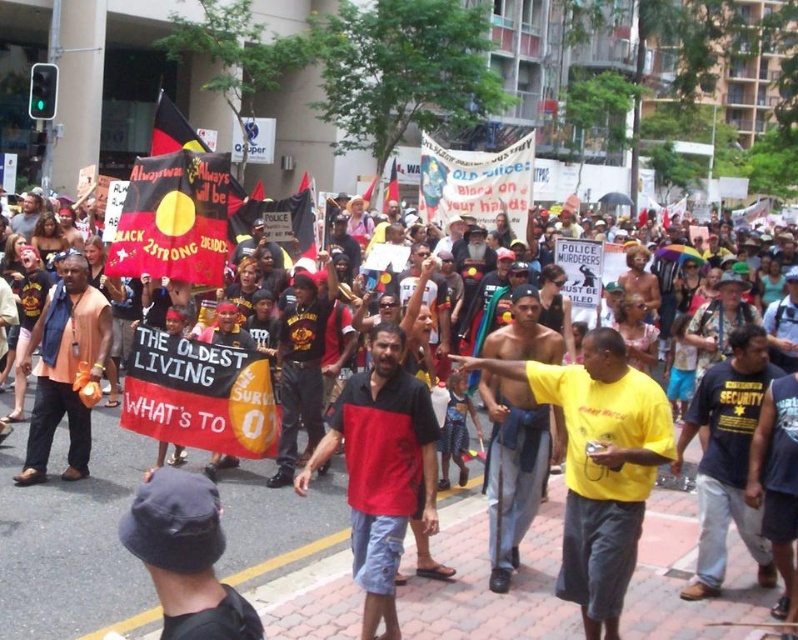
Question: Does matte orange shirt at left appear on the right side of red fabric flag at center?

Choices:
 (A) no
 (B) yes

Answer: (A)

Question: Which point is farther to the camera?

Choices:
 (A) matte orange shirt at left
 (B) red fabric flag at center

Answer: (B)

Question: Estimate the real-world distances between objects in this image. Which object is farther from the yellow cotton shirt at center?

Choices:
 (A) red fabric flag at center
 (B) yellow matte shirt at center
 (C) red/black shirt at center

Answer: (A)

Question: Is yellow cotton shirt at center smaller than red/black shirt at center?

Choices:
 (A) no
 (B) yes

Answer: (A)

Question: Which of these objects is positioned farthest from the red fabric flag at center?

Choices:
 (A) yellow cotton shirt at center
 (B) red fabric flag at upper left
 (C) matte orange shirt at left
 (D) yellow matte shirt at center

Answer: (D)

Question: Can you confirm if yellow matte shirt at center is positioned to the right of red/black shirt at center?

Choices:
 (A) no
 (B) yes

Answer: (A)